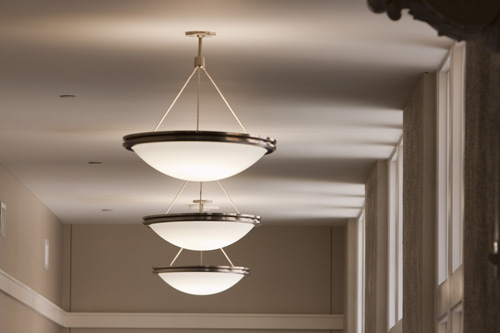
Identify the location of speakers. The image size is (500, 333). (45, 255), (3, 208).